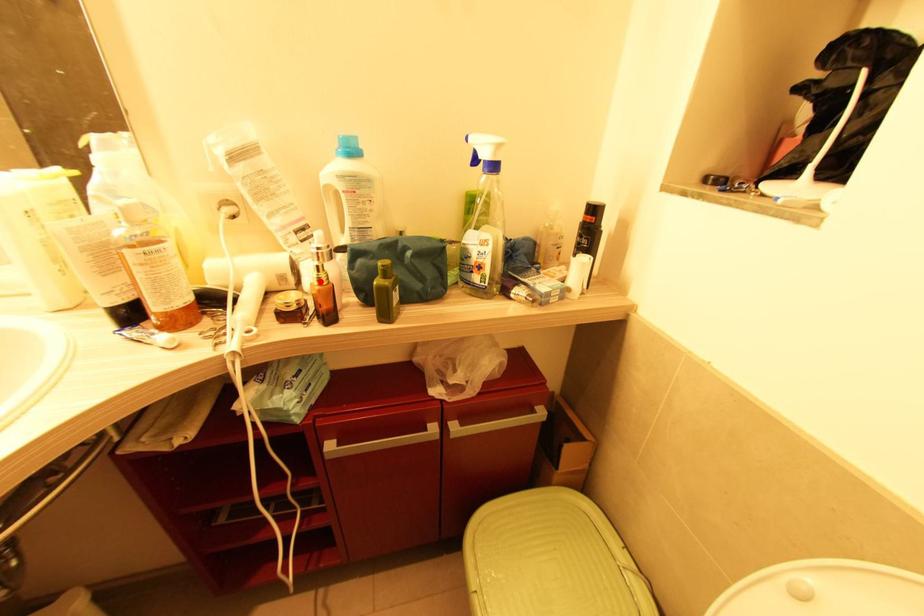
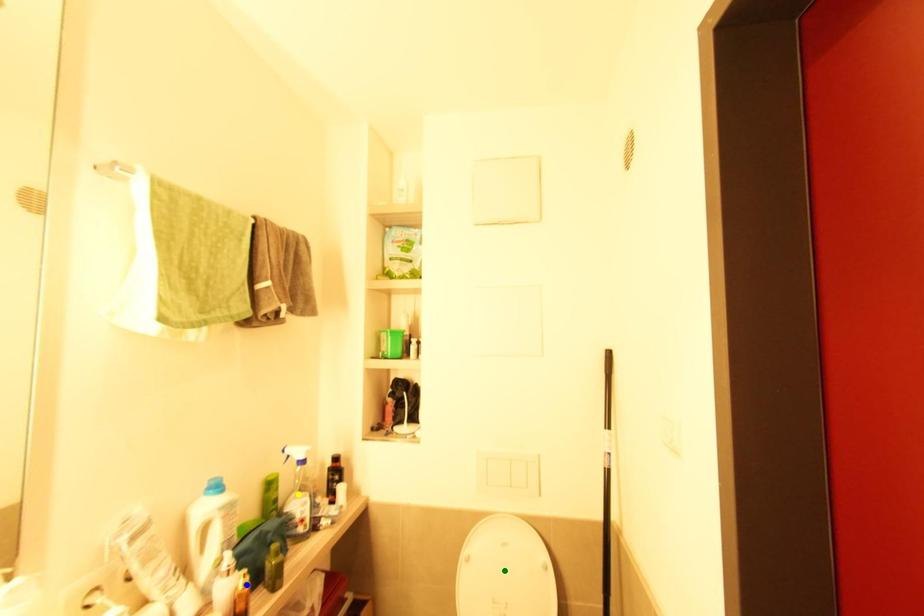
Question: I am providing you with two images of the same scene from different viewpoints. A red point is marked on the first image. You are given multiple points on the second image. Which point in image 2 is actually the same real-world point as the red point in image 1?

Choices:
 (A) green point
 (B) yellow point
 (C) blue point

Answer: (C)